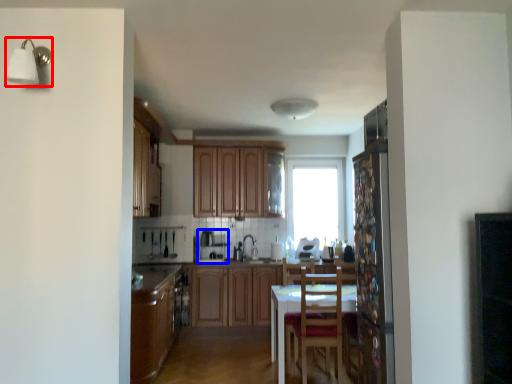
Question: Which object is closer to the camera taking this photo, light fixture (highlighted by a red box) or appliance (highlighted by a blue box)?

Choices:
 (A) light fixture
 (B) appliance

Answer: (A)